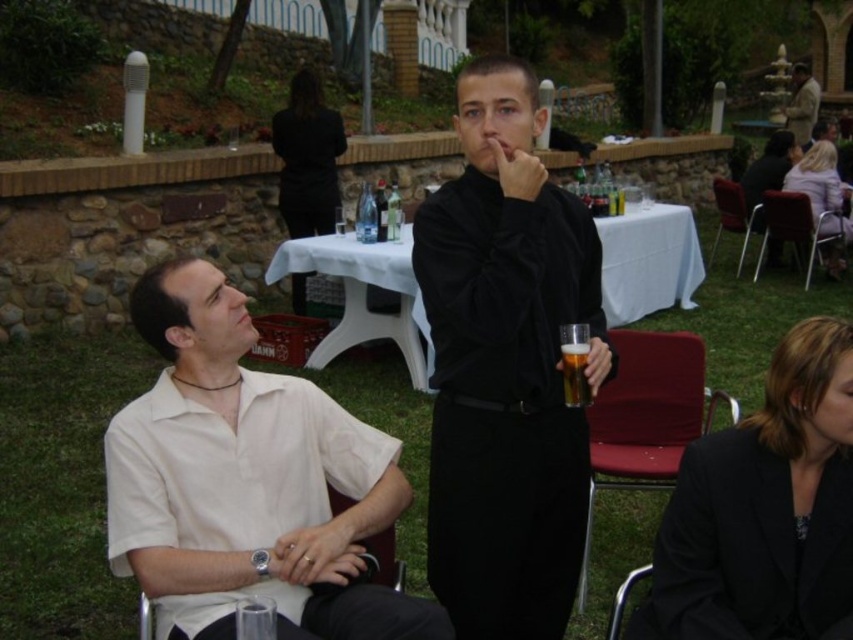
From the picture: You are standing in the garden and want to place a small potted plant between the two points, point [473,609] and point [653,280]. Which point should the plant be closer to in order to be equidistant from both points?

The plant should be placed closer to point [653,280] because point [473,609] is closer to the viewer, so the midpoint would require the plant to be closer to the farther point to balance the distance.

You are standing at the center of the garden and see the point at coordinates point (x=793, y=227). Which object is this point located on?

The point (x=793, y=227) is located on the metallic silver chair at right.